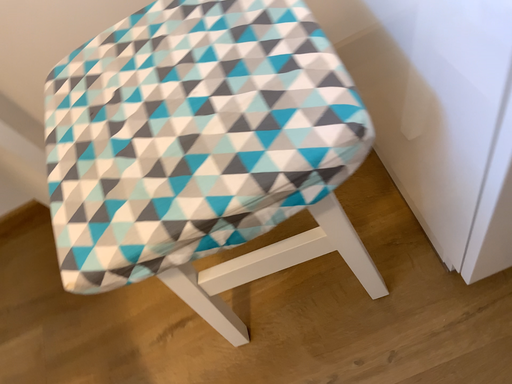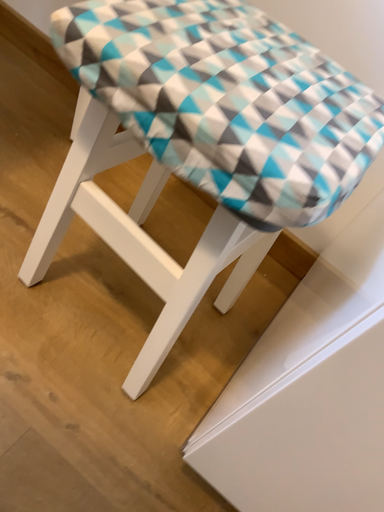
Question: Which way did the camera rotate in the video?

Choices:
 (A) rotated upward
 (B) rotated downward

Answer: (A)